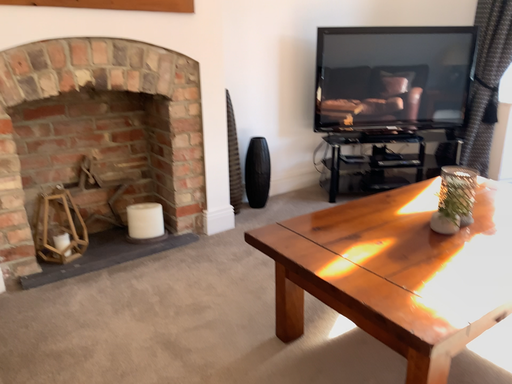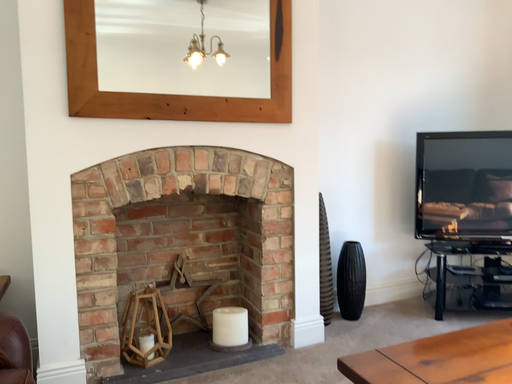
Question: How did the camera likely rotate when shooting the video?

Choices:
 (A) rotated left
 (B) rotated right

Answer: (A)